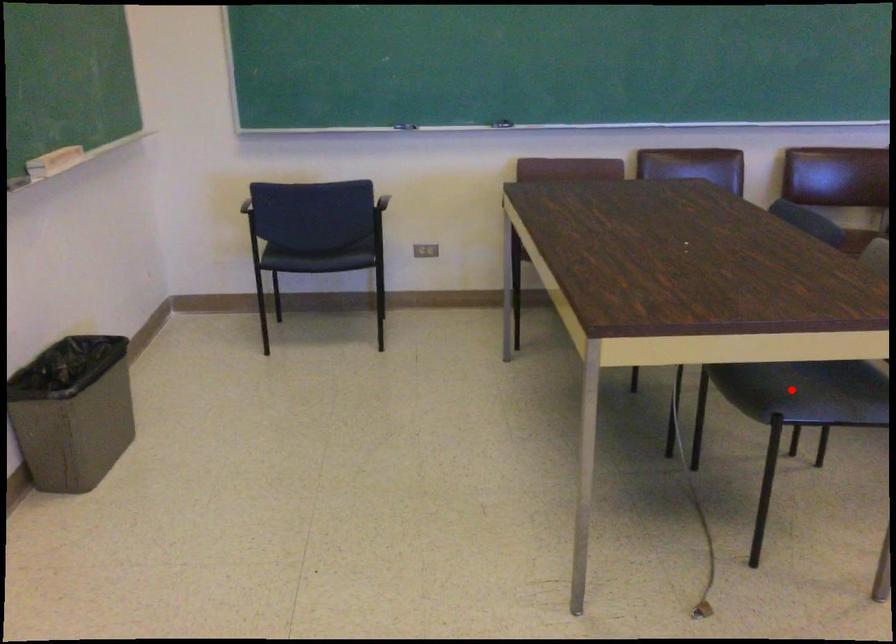
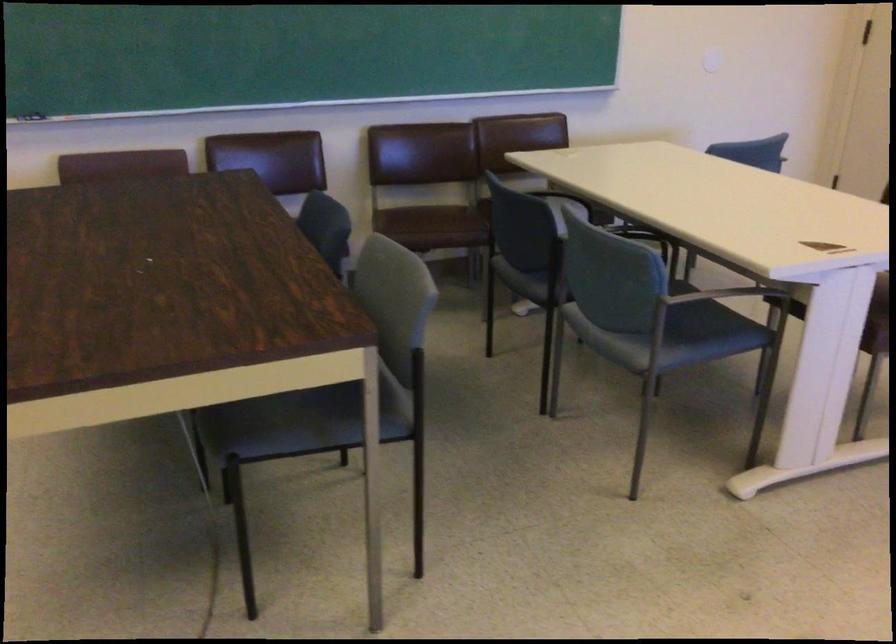
The point at the highlighted location is marked in the first image. Where is the corresponding point in the second image?

(282, 424)